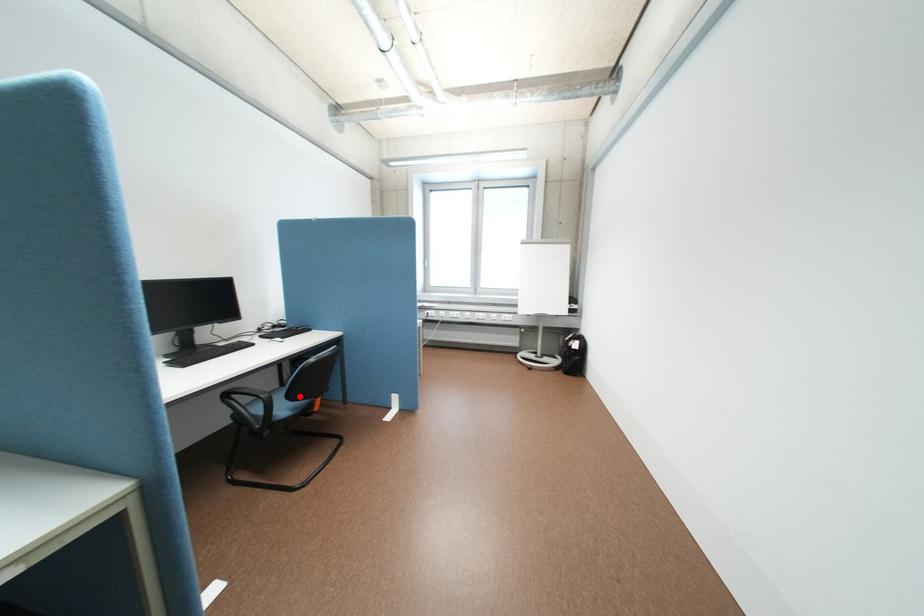
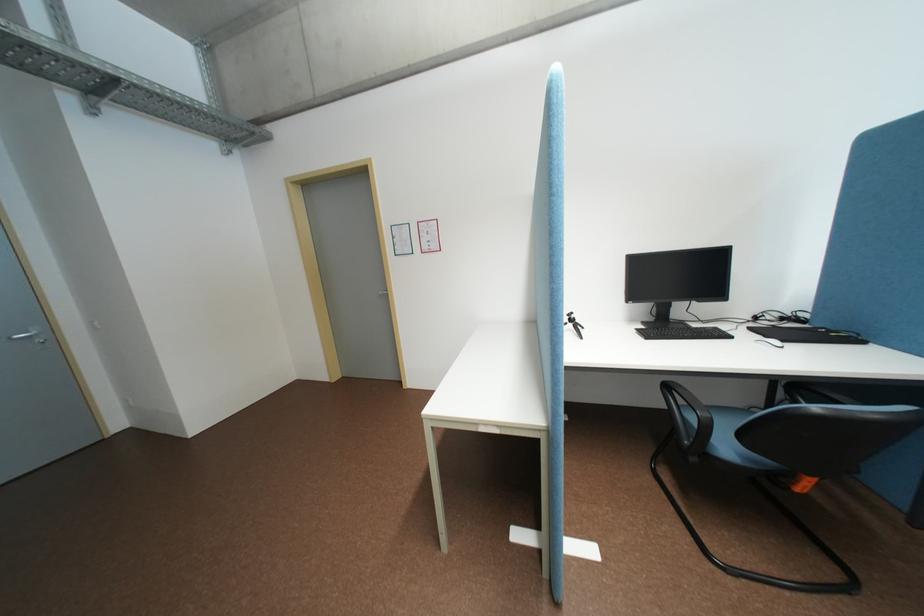
Find the pixel in the second image that matches the highlighted location in the first image.

(755, 437)